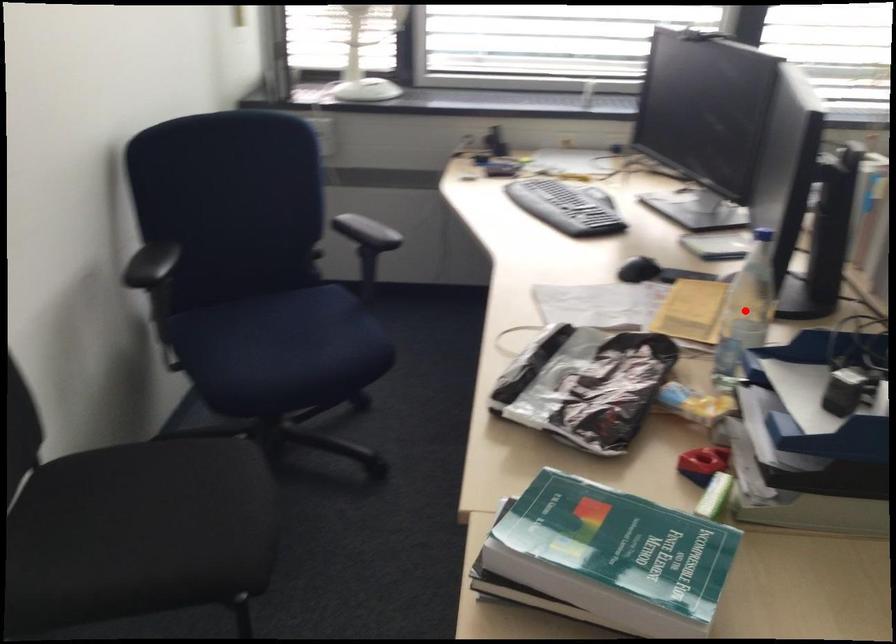
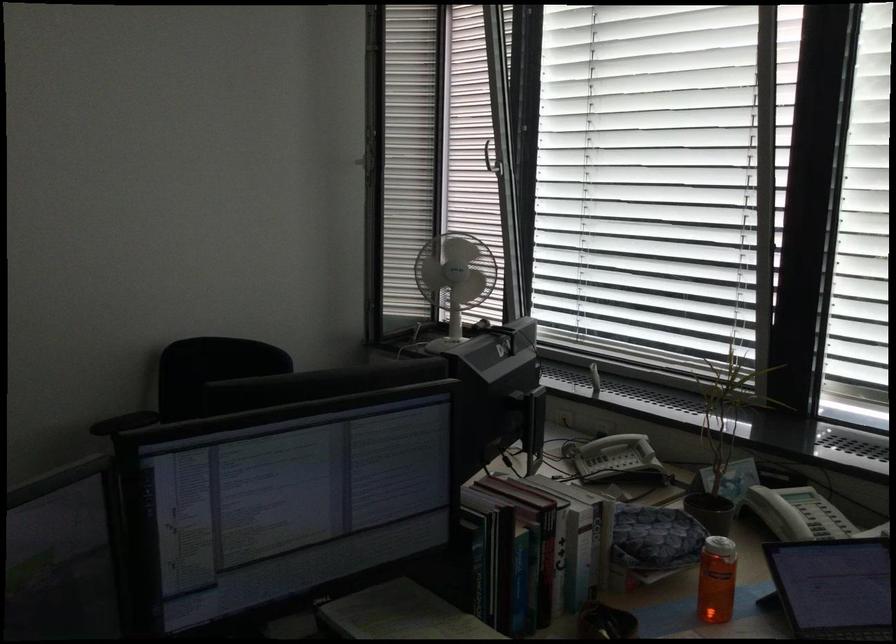
Question: I am providing you with two images of the same scene from different viewpoints. A red point is marked on the first image. At the location where the point appears in image 1, is it still visible in image 2?

Choices:
 (A) Yes
 (B) No

Answer: (B)